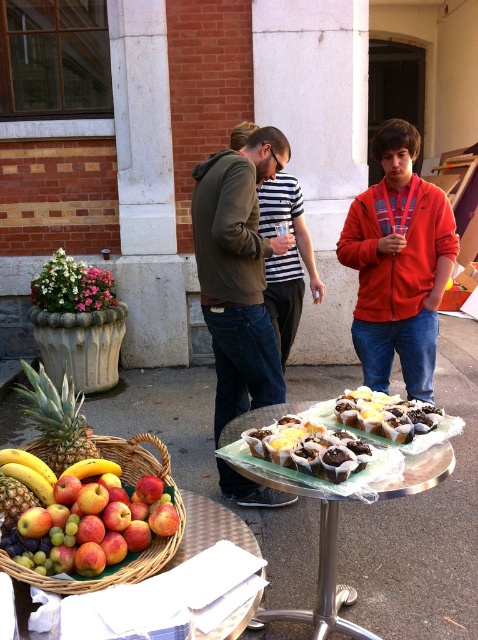
Does matte brown hoodie at center appear on the right side of woven brown basket at lower left?

Yes, matte brown hoodie at center is to the right of woven brown basket at lower left.

The image size is (478, 640). Identify the location of matte brown hoodie at center. [239, 273].

This screenshot has height=640, width=478. I want to click on matte brown hoodie at center, so click(239, 273).

Which of these two, matte brown hoodie at center or silver metallic table at center, stands taller?

With more height is matte brown hoodie at center.

Looking at this image, between matte brown hoodie at center and silver metallic table at center, which one appears on the left side from the viewer's perspective?

Positioned to the left is matte brown hoodie at center.

Where is `matte brown hoodie at center`? The image size is (478, 640). matte brown hoodie at center is located at coordinates (239, 273).

Where is `matte brown hoodie at center`? The height and width of the screenshot is (640, 478). matte brown hoodie at center is located at coordinates (239, 273).

Between matte red hoodie at center and matte brown hoodie at center, which one has more height?

Standing taller between the two is matte brown hoodie at center.

Identify the location of matte red hoodie at center. The height and width of the screenshot is (640, 478). (399, 264).

Locate an element on the screen. This screenshot has height=640, width=478. matte red hoodie at center is located at coordinates (399, 264).